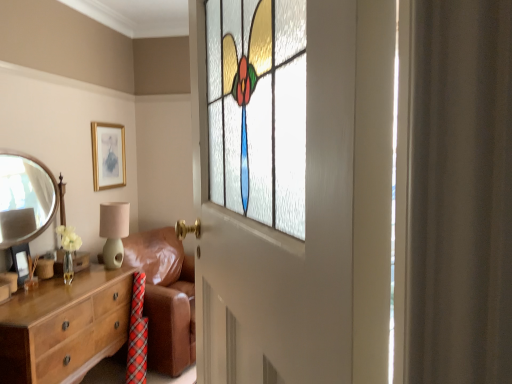
The height and width of the screenshot is (384, 512). What do you see at coordinates (166, 298) in the screenshot?
I see `brown leather couch at center` at bounding box center [166, 298].

Image resolution: width=512 pixels, height=384 pixels. I want to click on matte green ceramic table lamp at left, so click(114, 232).

At what (x,y) coordinates should I click in order to perform the action: click on gold metallic picture frame at upper center, which appears as the first picture frame when viewed from the right. Please return your answer as a coordinate pair (x, y). This screenshot has height=384, width=512. Looking at the image, I should click on (108, 155).

At what (x,y) coordinates should I click in order to perform the action: click on silver metallic mirror at left. Please return your answer as a coordinate pair (x, y). This screenshot has height=384, width=512. Looking at the image, I should click on (24, 198).

From a real-world perspective, is matte gold picture frame at lower left, placed as the second picture frame when sorted from back to front, beneath silver metallic mirror at left?

Yes, from a real-world perspective, matte gold picture frame at lower left, placed as the second picture frame when sorted from back to front, is under silver metallic mirror at left.

Starting from the silver metallic mirror at left, which picture frame is the 1st one behind? Please provide its 2D coordinates.

[(21, 262)]

Is matte gold picture frame at lower left, the 1th picture frame in the left-to-right sequence, next to silver metallic mirror at left?

There is a gap between matte gold picture frame at lower left, the 1th picture frame in the left-to-right sequence, and silver metallic mirror at left.

From the image's perspective, which is below, matte gold picture frame at lower left, which ranks as the first picture frame in front-to-back order, or silver metallic mirror at left?

From the image's view, matte gold picture frame at lower left, which ranks as the first picture frame in front-to-back order, is below.

Is matte green ceramic table lamp at left to the right of brown leather couch at center from the viewer's perspective?

In fact, matte green ceramic table lamp at left is to the left of brown leather couch at center.

Locate an element on the screen. studio couch that is on the right side of matte green ceramic table lamp at left is located at coordinates (166, 298).

Which of these two, matte green ceramic table lamp at left or brown leather couch at center, stands taller?

brown leather couch at center is taller.

From the image's perspective, which is above, matte green ceramic table lamp at left or brown leather couch at center?

From the image's view, matte green ceramic table lamp at left is above.

From a real-world perspective, is matte gold picture frame at lower left, which ranks as the first picture frame in front-to-back order, positioned over matte green ceramic table lamp at left based on gravity?

Actually, matte gold picture frame at lower left, which ranks as the first picture frame in front-to-back order, is physically below matte green ceramic table lamp at left in the real world.

Is matte gold picture frame at lower left, positioned as the second picture frame in right-to-left order, beside matte green ceramic table lamp at left?

There is a gap between matte gold picture frame at lower left, positioned as the second picture frame in right-to-left order, and matte green ceramic table lamp at left.

Which is farther, (11, 253) or (105, 228)?

The point (105, 228) is behind.

Is matte gold picture frame at lower left, which ranks as the first picture frame in front-to-back order, completely or partially outside of matte green ceramic table lamp at left?

Indeed, matte gold picture frame at lower left, which ranks as the first picture frame in front-to-back order, is completely outside matte green ceramic table lamp at left.

Is matte green ceramic table lamp at left turned away from silver metallic mirror at left?

Yes, silver metallic mirror at left is at the back of matte green ceramic table lamp at left.

Looking at this image, does matte green ceramic table lamp at left have a smaller size compared to silver metallic mirror at left?

Yes.

Considering their positions, is matte green ceramic table lamp at left located in front of or behind silver metallic mirror at left?

matte green ceramic table lamp at left is behind silver metallic mirror at left.

Considering the relative positions of matte green ceramic table lamp at left and silver metallic mirror at left in the image provided, is matte green ceramic table lamp at left to the right of silver metallic mirror at left from the viewer's perspective?

Indeed, matte green ceramic table lamp at left is positioned on the right side of silver metallic mirror at left.

Considering the relative positions of silver metallic mirror at left and gold metallic picture frame at upper center, which appears as the first picture frame when viewed from the back, in the image provided, is silver metallic mirror at left to the right of gold metallic picture frame at upper center, which appears as the first picture frame when viewed from the back, from the viewer's perspective?

Incorrect, silver metallic mirror at left is not on the right side of gold metallic picture frame at upper center, which appears as the first picture frame when viewed from the back.

Is silver metallic mirror at left wider than gold metallic picture frame at upper center, which appears as the first picture frame when viewed from the back?

Indeed, silver metallic mirror at left has a greater width compared to gold metallic picture frame at upper center, which appears as the first picture frame when viewed from the back.

From a real-world perspective, which object rests below the other?

silver metallic mirror at left is physically lower.

What's the angular difference between silver metallic mirror at left and gold metallic picture frame at upper center, which appears as the first picture frame when viewed from the right,'s facing directions?

0.000227 degrees.

Is wooden chest of drawers at left taller than matte green ceramic table lamp at left?

Indeed, wooden chest of drawers at left has a greater height compared to matte green ceramic table lamp at left.

From the picture: Is wooden chest of drawers at left turned away from matte green ceramic table lamp at left?

That's not correct — wooden chest of drawers at left is not looking away from matte green ceramic table lamp at left.

You are a GUI agent. You are given a task and a screenshot of the screen. Output one action in this format:
    pyautogui.click(x=<x>, y=<y>)
    Task: Click on the chest of drawers below the matte green ceramic table lamp at left (from the image's perspective)
    The width and height of the screenshot is (512, 384).
    Given the screenshot: What is the action you would take?
    pyautogui.click(x=65, y=326)

Is wooden chest of drawers at left inside or outside of brown leather couch at center?

The correct answer is: outside.

Based on their sizes in the image, would you say wooden chest of drawers at left is bigger or smaller than brown leather couch at center?

In the image, wooden chest of drawers at left appears to be smaller than brown leather couch at center.

Between wooden chest of drawers at left and brown leather couch at center, which one has less height?

With less height is wooden chest of drawers at left.

Can you tell me how much wooden chest of drawers at left and brown leather couch at center differ in facing direction?

wooden chest of drawers at left and brown leather couch at center are facing 17.2 degrees away from each other.

Where is `the 1st picture frame behind the silver metallic mirror at left, starting your count from the anchor`? The image size is (512, 384). the 1st picture frame behind the silver metallic mirror at left, starting your count from the anchor is located at coordinates pos(21,262).

The height and width of the screenshot is (384, 512). Identify the location of studio couch located in front of the matte green ceramic table lamp at left. (166, 298).

Looking at the image, which one is located further to silver metallic mirror at left, stained glass window at center or brown leather couch at center?

The object further to silver metallic mirror at left is stained glass window at center.

When comparing their distances from wooden chest of drawers at left, does gold metallic picture frame at upper center, which appears as the first picture frame when viewed from the back, or brown leather couch at center seem closer?

The object closer to wooden chest of drawers at left is brown leather couch at center.

Considering their positions, is stained glass window at center positioned further to brown leather couch at center than gold metallic picture frame at upper center, which appears as the first picture frame when viewed from the right?

The object further to brown leather couch at center is stained glass window at center.

In the scene shown: When comparing their distances from matte gold picture frame at lower left, positioned as the second picture frame in right-to-left order, does wooden chest of drawers at left or matte green ceramic table lamp at left seem further?

The object further to matte gold picture frame at lower left, positioned as the second picture frame in right-to-left order, is matte green ceramic table lamp at left.

From the image, which object appears to be nearer to matte green ceramic table lamp at left, stained glass window at center or matte gold picture frame at lower left, which is the 2th picture frame from top to bottom?

The object closer to matte green ceramic table lamp at left is matte gold picture frame at lower left, which is the 2th picture frame from top to bottom.

Which object lies further to the anchor point wooden chest of drawers at left, matte green ceramic table lamp at left or brown leather couch at center?

The object further to wooden chest of drawers at left is brown leather couch at center.

In the scene shown: Looking at the image, which one is located closer to wooden chest of drawers at left, brown leather couch at center or stained glass window at center?

Among the two, brown leather couch at center is located nearer to wooden chest of drawers at left.

Looking at the image, which one is located further to stained glass window at center, matte gold picture frame at lower left, placed as the 1th picture frame when sorted from bottom to top, or matte green ceramic table lamp at left?

matte green ceramic table lamp at left.

This screenshot has width=512, height=384. I want to click on studio couch between wooden chest of drawers at left and matte green ceramic table lamp at left in the front-back direction, so click(x=166, y=298).

Locate an element on the screen. This screenshot has width=512, height=384. studio couch between silver metallic mirror at left and wooden chest of drawers at left in the vertical direction is located at coordinates (166, 298).

The width and height of the screenshot is (512, 384). What are the coordinates of `table lamp between gold metallic picture frame at upper center, the 2th picture frame positioned from the bottom, and brown leather couch at center in the up-down direction` in the screenshot? It's located at (114, 232).

I want to click on studio couch positioned between stained glass window at center and gold metallic picture frame at upper center, the 2th picture frame when ordered from left to right, from near to far, so click(166, 298).